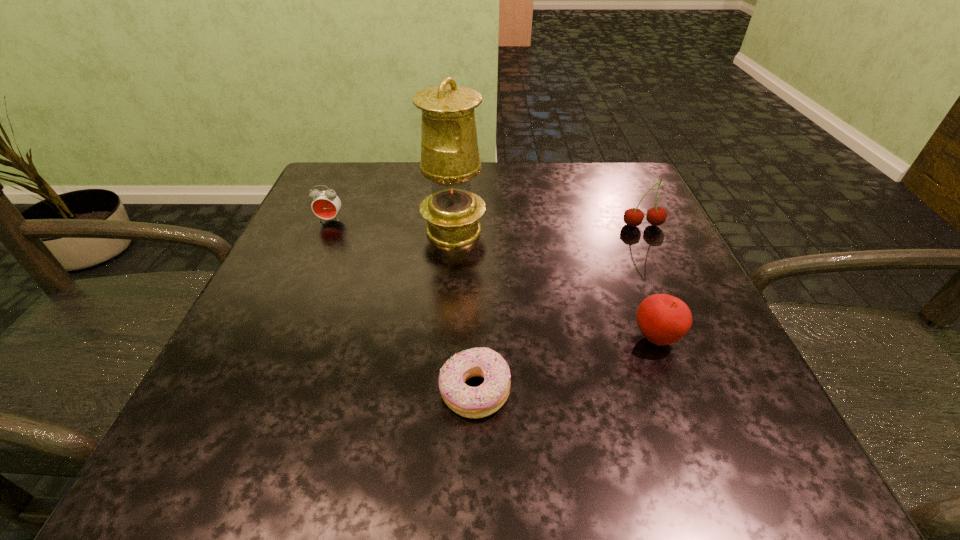
Locate an element on the screen. free space between the alarm clock and the tallest object is located at coordinates (392, 225).

At what (x,y) coordinates should I click in order to perform the action: click on free space between the shortest object and the alarm clock. Please return your answer as a coordinate pair (x, y). The height and width of the screenshot is (540, 960). Looking at the image, I should click on (402, 306).

Where is `vacant space that is in between the cherry and the shortest object`? vacant space that is in between the cherry and the shortest object is located at coordinates (559, 309).

This screenshot has height=540, width=960. I want to click on free spot between the cherry and the shortest object, so click(x=559, y=309).

You are a GUI agent. You are given a task and a screenshot of the screen. Output one action in this format:
    pyautogui.click(x=<x>, y=<y>)
    Task: Click on the vacant space that's between the leftmost object and the tallest object
    The image size is (960, 540).
    Given the screenshot: What is the action you would take?
    pyautogui.click(x=392, y=225)

Find the location of a particular element. The image size is (960, 540). object that ranks as the third closest to the nearest object is located at coordinates (633, 217).

At what (x,y) coordinates should I click in order to perform the action: click on object identified as the closest to the cherry. Please return your answer as a coordinate pair (x, y). Image resolution: width=960 pixels, height=540 pixels. Looking at the image, I should click on [x=663, y=319].

Locate an element on the screen. The height and width of the screenshot is (540, 960). free location that satisfies the following two spatial constraints: 1. on the face of the doughnut; 2. on the right side of the leftmost object is located at coordinates (254, 392).

At what (x,y) coordinates should I click in order to perform the action: click on vacant position in the image that satisfies the following two spatial constraints: 1. on the face of the oil lamp; 2. on the left side of the alarm clock. Please return your answer as a coordinate pair (x, y). The height and width of the screenshot is (540, 960). Looking at the image, I should click on (325, 231).

Identify the location of vacant position in the image that satisfies the following two spatial constraints: 1. on the face of the doughnut; 2. on the right side of the leftmost object. (254, 392).